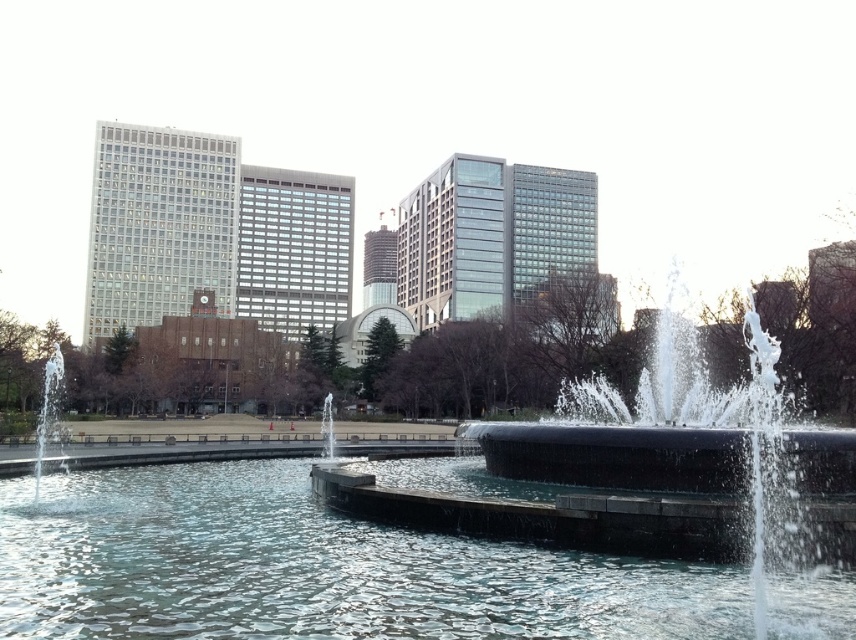
Question: Is clear water at center positioned in front of clear glass fountain at center?

Choices:
 (A) yes
 (B) no

Answer: (A)

Question: Observing the image, what is the correct spatial positioning of clear water at center in reference to clear glass fountain at center?

Choices:
 (A) left
 (B) right

Answer: (B)

Question: Among these points, which one is nearest to the camera?

Choices:
 (A) (334, 467)
 (B) (559, 600)

Answer: (B)

Question: Where is clear water at center located in relation to clear glass fountain at center in the image?

Choices:
 (A) below
 (B) above

Answer: (B)

Question: Which point appears closest to the camera in this image?

Choices:
 (A) (331, 465)
 (B) (159, 580)

Answer: (B)